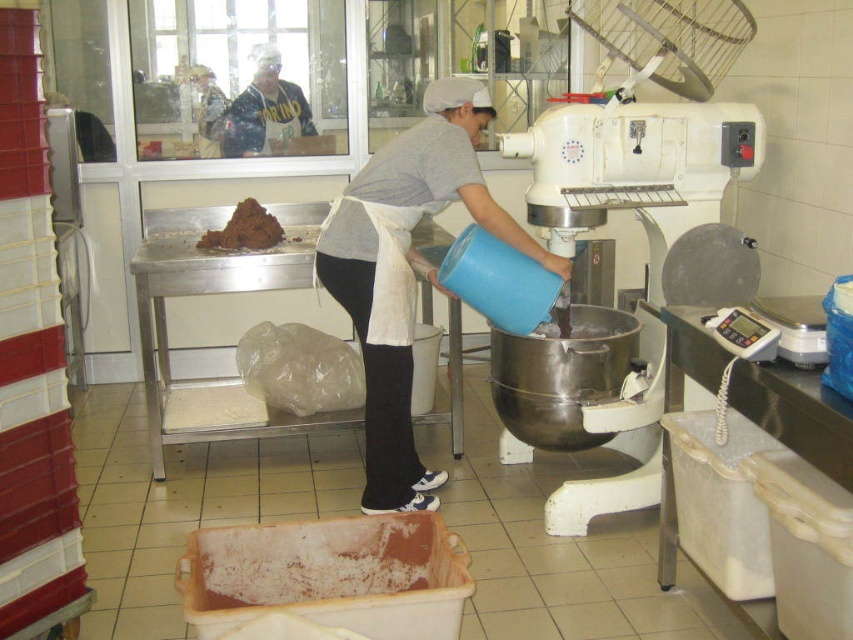
Is blue matte bucket at center bigger than brown crumbly dough at upper center?

Yes.

Is point (393, 440) less distant than point (268, 227)?

Yes, point (393, 440) is closer to viewer.

I want to click on blue matte bucket at center, so click(407, 269).

Who is shorter, stainless steel mixer at center or blue matte bucket at center?

With less height is blue matte bucket at center.

Which is below, stainless steel mixer at center or blue matte bucket at center?

stainless steel mixer at center is lower down.

Describe the element at coordinates (645, 237) in the screenshot. I see `stainless steel mixer at center` at that location.

Locate an element on the screen. stainless steel mixer at center is located at coordinates (645, 237).

Between brown matte container at lower center and brown crumbly dough at upper center, which one has less height?

brown matte container at lower center is shorter.

Can you confirm if brown matte container at lower center is positioned above brown crumbly dough at upper center?

No.

Between point (308, 541) and point (265, 220), which one is positioned in front?

Positioned in front is point (308, 541).

Locate an element on the screen. The width and height of the screenshot is (853, 640). brown matte container at lower center is located at coordinates (312, 561).